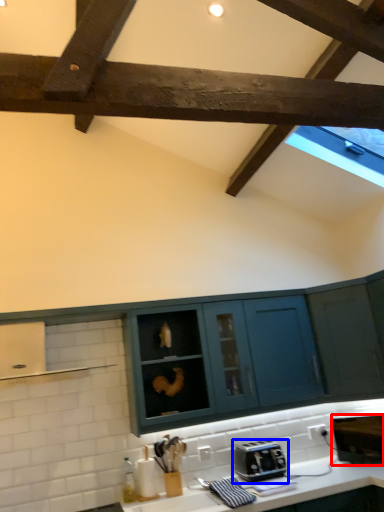
Question: Which of the following is the farthest to the observer, appliance (highlighted by a red box) or toaster (highlighted by a blue box)?

Choices:
 (A) appliance
 (B) toaster

Answer: (A)